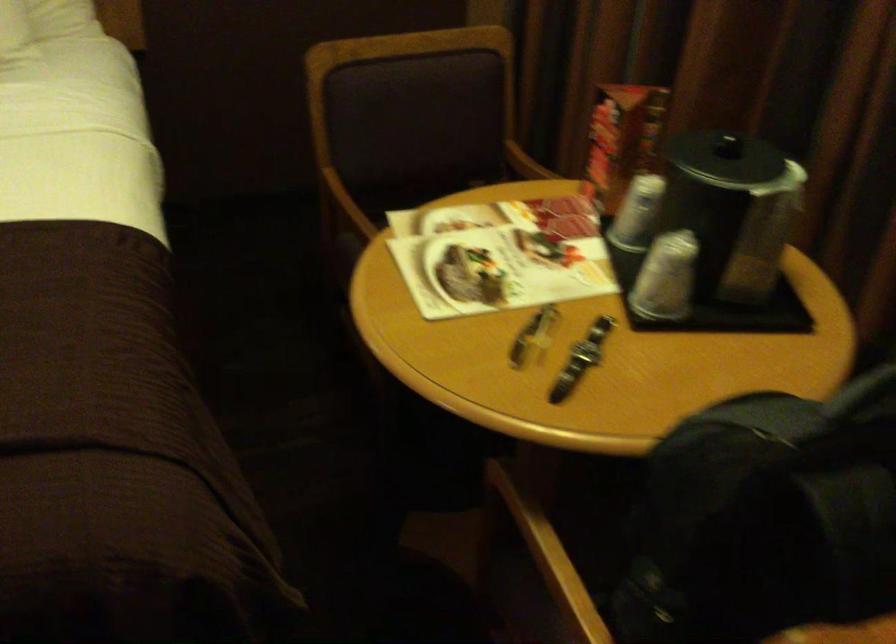
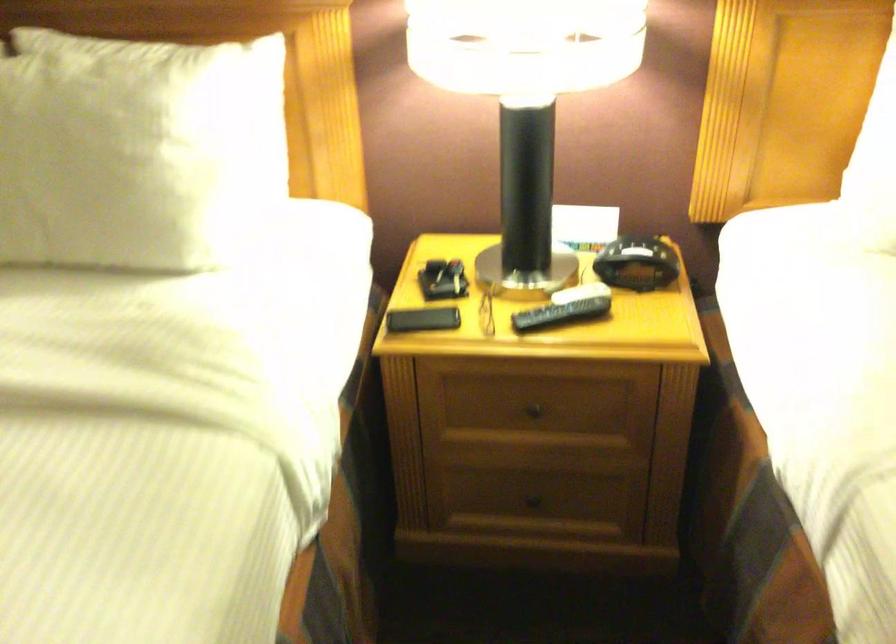
Question: The images are taken continuously from a first-person perspective. In which direction are you moving?

Choices:
 (A) Left
 (B) Right
 (C) Forward
 (D) Backward

Answer: (A)